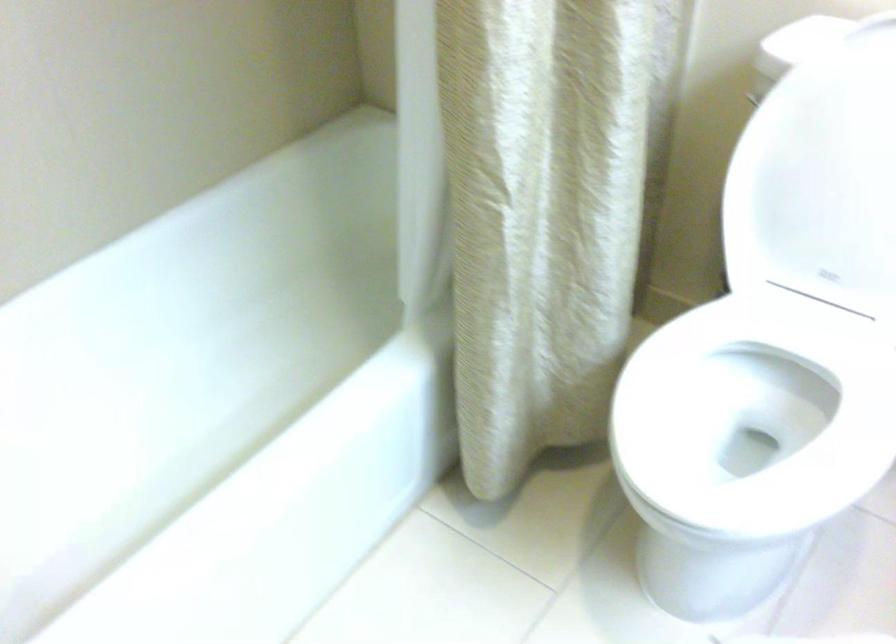
The first image is from the beginning of the video and the second image is from the end. How did the camera likely rotate when shooting the video?

The camera rotated toward right-down.